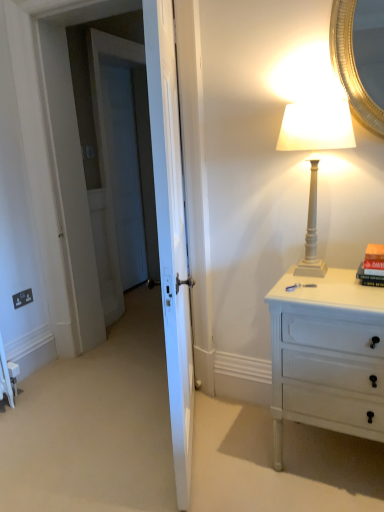
Question: Should I look upward or downward to see white glossy door at center?

Choices:
 (A) down
 (B) up

Answer: (B)

Question: Would you consider white painted wood chest of drawers at right to be distant from white matte lamp at upper right?

Choices:
 (A) yes
 (B) no

Answer: (B)

Question: Is white painted wood chest of drawers at right to the left of white matte lamp at upper right from the viewer's perspective?

Choices:
 (A) yes
 (B) no

Answer: (B)

Question: From a real-world perspective, is white painted wood chest of drawers at right located beneath white matte lamp at upper right?

Choices:
 (A) yes
 (B) no

Answer: (A)

Question: Is white painted wood chest of drawers at right next to white matte lamp at upper right and touching it?

Choices:
 (A) yes
 (B) no

Answer: (B)

Question: Is white painted wood chest of drawers at right taller than white matte lamp at upper right?

Choices:
 (A) no
 (B) yes

Answer: (B)

Question: Does white painted wood chest of drawers at right lie behind white matte lamp at upper right?

Choices:
 (A) no
 (B) yes

Answer: (A)

Question: Is white glossy door at center wider than hardcover book at right?

Choices:
 (A) no
 (B) yes

Answer: (A)

Question: Can you confirm if white glossy door at center is bigger than hardcover book at right?

Choices:
 (A) yes
 (B) no

Answer: (A)

Question: Is white glossy door at center shorter than hardcover book at right?

Choices:
 (A) yes
 (B) no

Answer: (B)

Question: From the image's perspective, is white glossy door at center under hardcover book at right?

Choices:
 (A) yes
 (B) no

Answer: (B)

Question: Is hardcover book at right inside white glossy door at center?

Choices:
 (A) no
 (B) yes

Answer: (A)

Question: Is white glossy door at center in front of hardcover book at right?

Choices:
 (A) no
 (B) yes

Answer: (B)

Question: Is white matte lamp at upper right bigger than hardcover book at right?

Choices:
 (A) no
 (B) yes

Answer: (B)